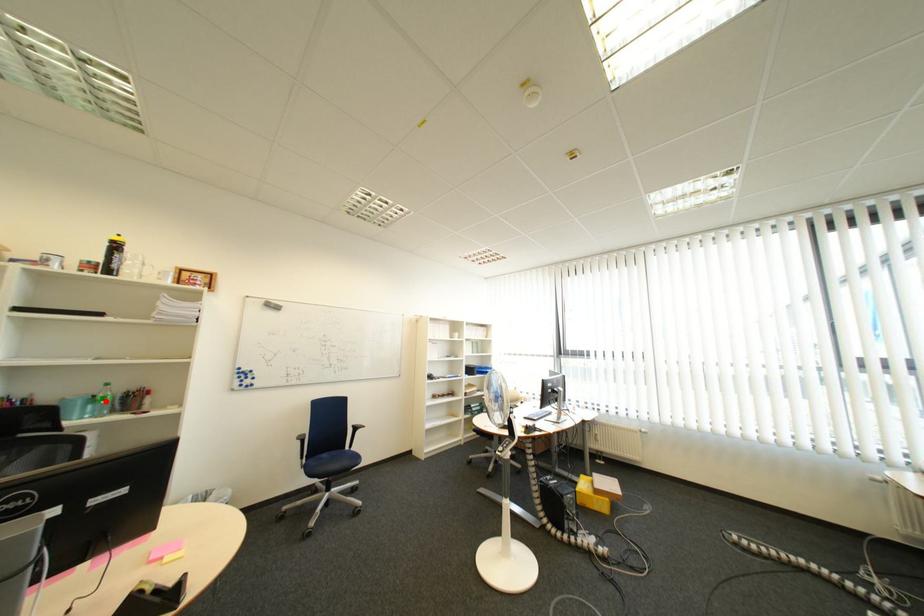
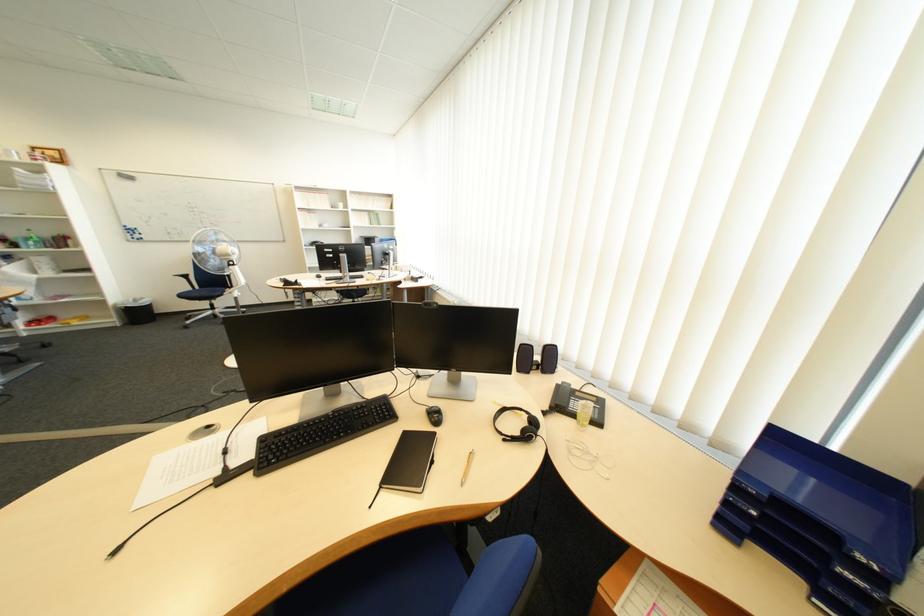
Locate, in the second image, the point that corresponds to the highlighted location in the first image.

(41, 240)